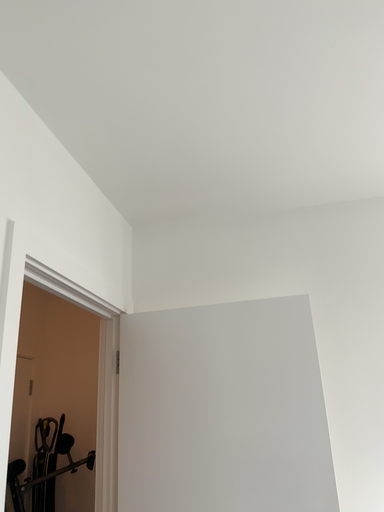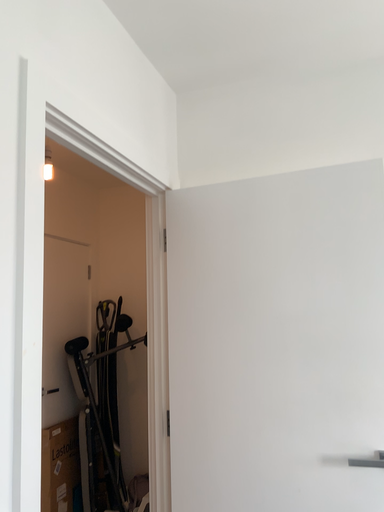
Question: Which way did the camera rotate in the video?

Choices:
 (A) rotated downward
 (B) rotated upward

Answer: (A)